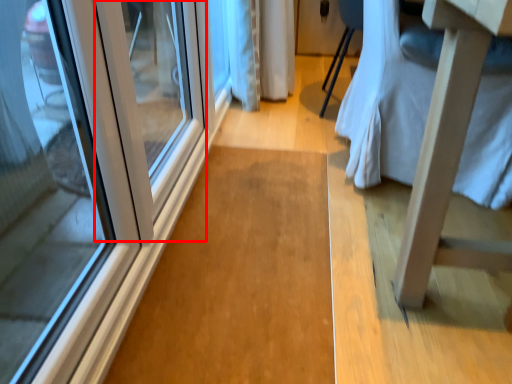
Question: Considering the relative positions of door (annotated by the red box) and changing table in the image provided, where is door (annotated by the red box) located with respect to the staircase?

Choices:
 (A) right
 (B) left

Answer: (B)